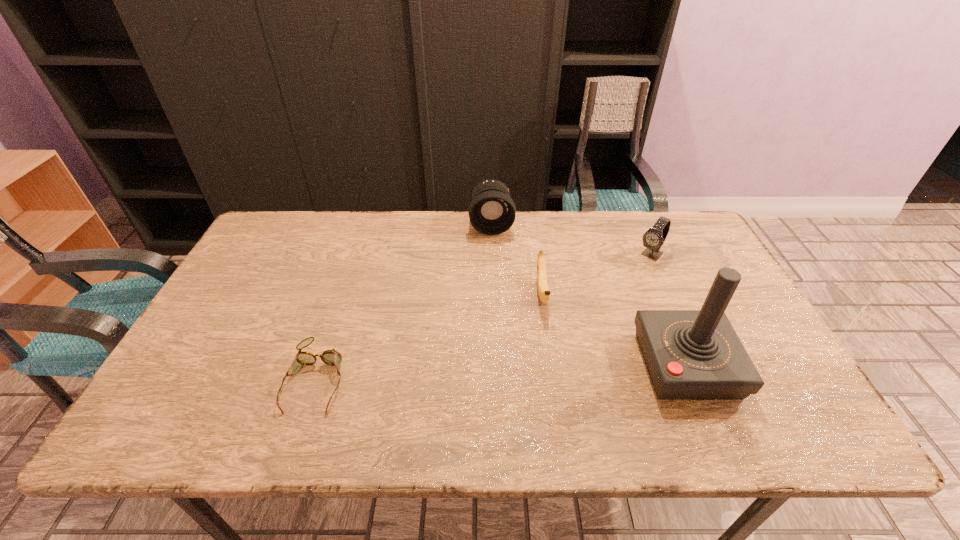
In the image, there is a desktop. Where is `vacant region at the far right corner`? vacant region at the far right corner is located at coordinates (704, 252).

This screenshot has width=960, height=540. In the image, there is a desktop. Identify the location of vacant space at the near right corner. (798, 397).

Identify the location of free space between the banana and the leftmost object. The height and width of the screenshot is (540, 960). (429, 336).

The width and height of the screenshot is (960, 540). In order to click on blank region between the second tallest object and the banana in this screenshot , I will do `click(516, 258)`.

The height and width of the screenshot is (540, 960). In order to click on vacant area that lies between the telephoto lens and the tallest object in this screenshot , I will do `click(588, 294)`.

This screenshot has height=540, width=960. Find the location of `free spot between the watch and the second shortest object`. free spot between the watch and the second shortest object is located at coordinates (596, 274).

Where is `vacant space that is in between the joystick and the shortest object`? vacant space that is in between the joystick and the shortest object is located at coordinates 501,372.

Image resolution: width=960 pixels, height=540 pixels. In order to click on empty space between the spectacles and the tallest object in this screenshot , I will do `click(501, 372)`.

This screenshot has width=960, height=540. Identify the location of vacant area between the banana and the fourth object from right to left. [516, 258].

Where is `vacant space in between the banana and the spectacles`? The height and width of the screenshot is (540, 960). vacant space in between the banana and the spectacles is located at coordinates (429, 336).